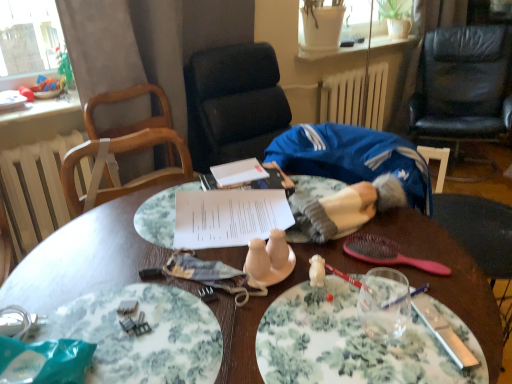
Question: Is white matte radiator at upper center, placed as the second radiator when sorted from left to right, facing away from white radiator at left, which is counted as the 2th radiator, starting from the right?

Choices:
 (A) yes
 (B) no

Answer: (B)

Question: Is white matte radiator at upper center, which appears as the 1th radiator when viewed from the top, outside white radiator at left, arranged as the second radiator when viewed from the top?

Choices:
 (A) yes
 (B) no

Answer: (A)

Question: Is the surface of white matte radiator at upper center, which ranks as the 1th radiator in right-to-left order, in direct contact with white radiator at left, the first radiator viewed from the left?

Choices:
 (A) no
 (B) yes

Answer: (A)

Question: Considering the relative sizes of white matte radiator at upper center, which is counted as the 1th radiator, starting from the back, and white radiator at left, the first radiator viewed from the front, in the image provided, is white matte radiator at upper center, which is counted as the 1th radiator, starting from the back, bigger than white radiator at left, the first radiator viewed from the front,?

Choices:
 (A) yes
 (B) no

Answer: (A)

Question: Considering the relative positions of white matte radiator at upper center, which ranks as the 1th radiator in right-to-left order, and white radiator at left, the first radiator viewed from the left, in the image provided, is white matte radiator at upper center, which ranks as the 1th radiator in right-to-left order, behind white radiator at left, the first radiator viewed from the left,?

Choices:
 (A) yes
 (B) no

Answer: (A)

Question: From a real-world perspective, is white paper at center physically located above or below white matte radiator at upper center, which ranks as the 1th radiator in right-to-left order?

Choices:
 (A) below
 (B) above

Answer: (B)

Question: Does point (229, 243) appear closer or farther from the camera than point (355, 94)?

Choices:
 (A) farther
 (B) closer

Answer: (B)

Question: Is white paper at center bigger or smaller than white matte radiator at upper center, placed as the second radiator when sorted from left to right?

Choices:
 (A) big
 (B) small

Answer: (B)

Question: Relative to white matte radiator at upper center, which ranks as the 1th radiator in right-to-left order, is white paper at center in front or behind?

Choices:
 (A) behind
 (B) front

Answer: (B)

Question: From the image's perspective, relative to white ceramic salt and pepper shakers at center, is floral ceramic plate at center, marked as the first plate in a right-to-left arrangement, above or below?

Choices:
 (A) below
 (B) above

Answer: (A)

Question: From a real-world perspective, is floral ceramic plate at center, the second plate viewed from the left, above or below white ceramic salt and pepper shakers at center?

Choices:
 (A) above
 (B) below

Answer: (B)

Question: Is floral ceramic plate at center, the second plate viewed from the left, wider or thinner than white ceramic salt and pepper shakers at center?

Choices:
 (A) wide
 (B) thin

Answer: (A)

Question: Based on their positions, is floral ceramic plate at center, the second plate viewed from the left, located to the left or right of white ceramic salt and pepper shakers at center?

Choices:
 (A) left
 (B) right

Answer: (B)

Question: In the image, is black leather chair at upper right positioned in front of or behind white paper at center?

Choices:
 (A) behind
 (B) front

Answer: (A)

Question: Does point (476, 74) appear closer or farther from the camera than point (233, 208)?

Choices:
 (A) farther
 (B) closer

Answer: (A)